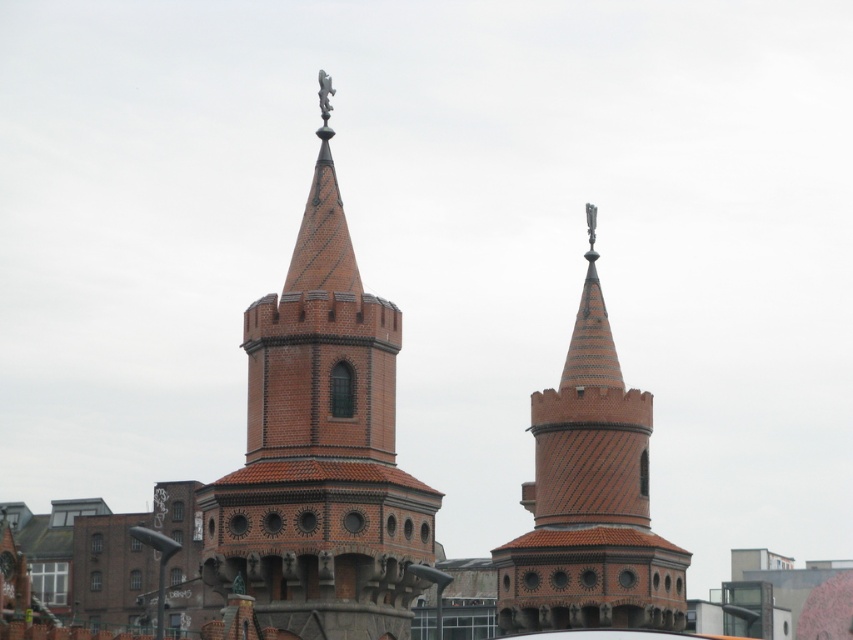
Who is shorter, brown brick tower at center or brown textured brick tower at center?

With less height is brown textured brick tower at center.

The width and height of the screenshot is (853, 640). I want to click on brown brick tower at center, so click(320, 448).